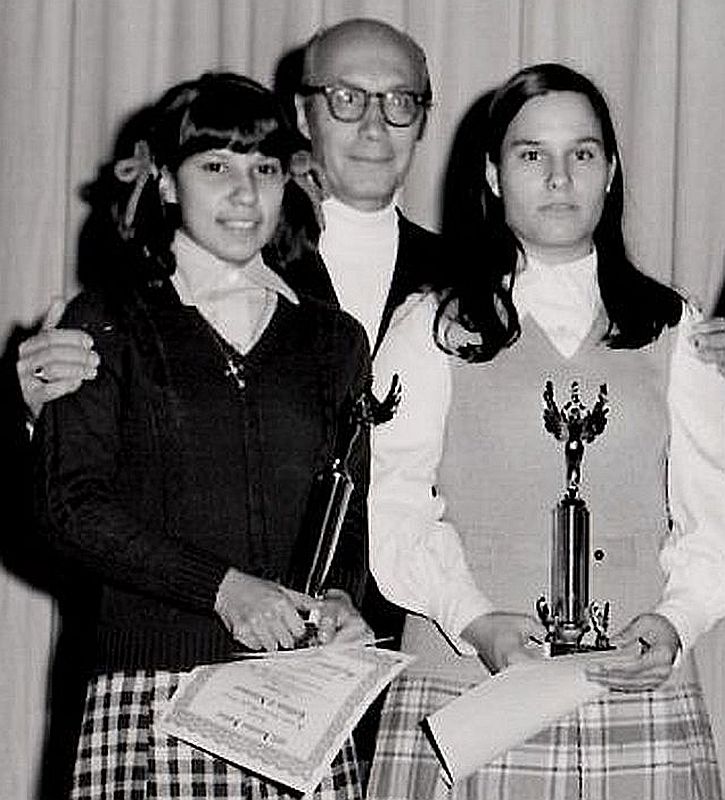
This screenshot has height=800, width=725. What are the coordinates of `trophies` in the screenshot? It's located at (343, 504), (573, 518).